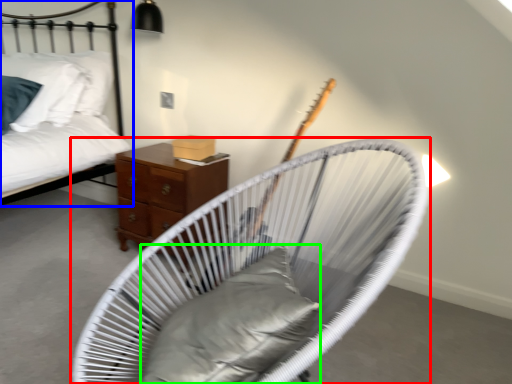
Question: Considering the real-world distances, which object is closest to furniture (highlighted by a red box)? bed (highlighted by a blue box) or pillow (highlighted by a green box).

Choices:
 (A) bed
 (B) pillow

Answer: (B)